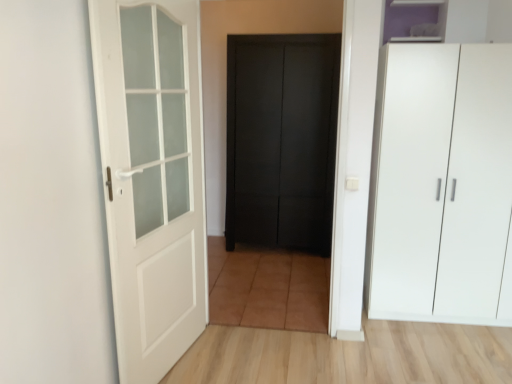
Question: Is matte black door at center, positioned as the 1th door in back-to-front order, facing towards white matte door at left, the 2th door positioned from the right?

Choices:
 (A) yes
 (B) no

Answer: (A)

Question: Is matte black door at center, placed as the second door when sorted from left to right, in contact with white matte door at left, the first door positioned from the left?

Choices:
 (A) no
 (B) yes

Answer: (A)

Question: Is matte black door at center, acting as the second door starting from the front, smaller than white matte door at left, the 2th door when ordered from back to front?

Choices:
 (A) no
 (B) yes

Answer: (A)

Question: From a real-world perspective, is matte black door at center, placed as the second door when sorted from left to right, physically below white matte door at left, the 2th door when ordered from back to front?

Choices:
 (A) no
 (B) yes

Answer: (B)

Question: From the image's perspective, is matte black door at center, acting as the second door starting from the front, located above white matte door at left, which ranks as the 1th door in front-to-back order?

Choices:
 (A) no
 (B) yes

Answer: (B)

Question: Is matte black door at center, acting as the second door starting from the front, closer to the viewer compared to white matte door at left, the 2th door when ordered from back to front?

Choices:
 (A) no
 (B) yes

Answer: (A)

Question: Is white matte cupboard at right bigger than purple matte cabinet at upper right?

Choices:
 (A) no
 (B) yes

Answer: (B)

Question: Would you say purple matte cabinet at upper right is part of white matte cupboard at right's contents?

Choices:
 (A) no
 (B) yes

Answer: (A)

Question: Can you confirm if white matte cupboard at right is shorter than purple matte cabinet at upper right?

Choices:
 (A) yes
 (B) no

Answer: (B)

Question: Does white matte cupboard at right appear on the right side of purple matte cabinet at upper right?

Choices:
 (A) yes
 (B) no

Answer: (A)

Question: Does white matte cupboard at right have a greater width compared to purple matte cabinet at upper right?

Choices:
 (A) no
 (B) yes

Answer: (B)

Question: Is white matte cupboard at right further to the viewer compared to purple matte cabinet at upper right?

Choices:
 (A) yes
 (B) no

Answer: (B)

Question: Is white matte door at left, the first door positioned from the left, shorter than white matte cupboard at right?

Choices:
 (A) no
 (B) yes

Answer: (A)